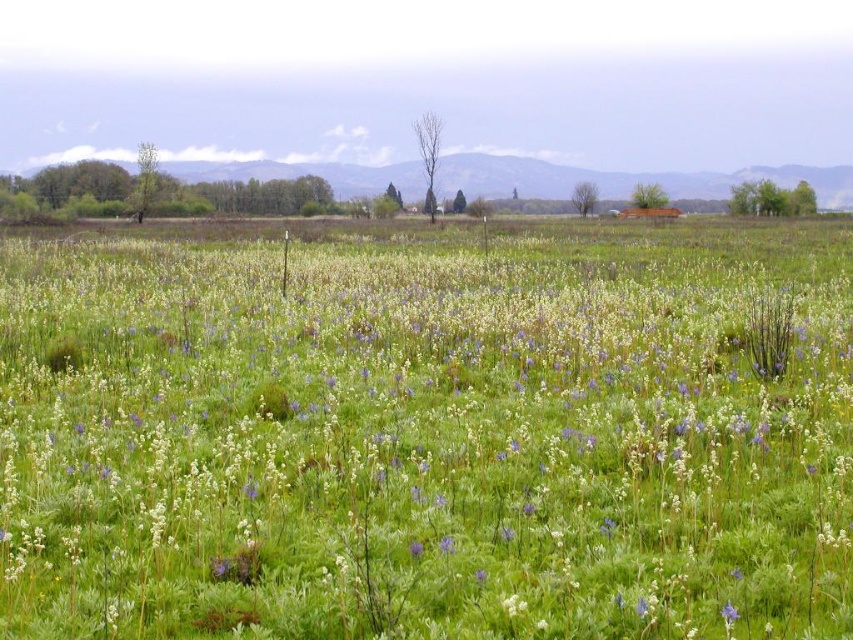
Looking at this image, you are standing at the origin point in the center of the field. There are two points marked in the image. Which point is closer to you, point (424, 406) or point (730, 604)?

Point (730, 604) is closer to you because it is in front of point (424, 406) according to the spatial relationship provided.

You are a botanist examining the field. You notice the white fluffy plant at center and the purple matte flower at lower right. Which one has a larger size?

The white fluffy plant at center is bigger than the purple matte flower at lower right.

You are standing in the open field and want to pick the purple matte flower at lower right. Which direction should you move relative to the white fluffy plant at center?

To reach the purple matte flower at lower right, you should move to the right from the white fluffy plant at center since it is located to the right of it.